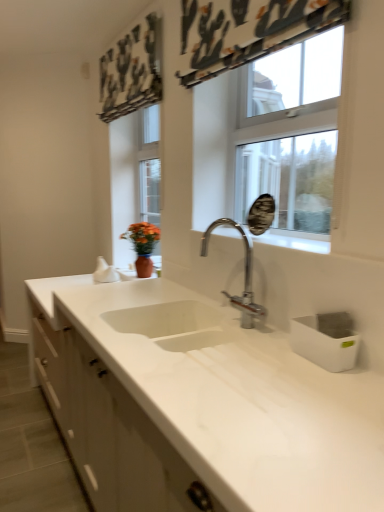
Question: Considering the positions of chrome metallic faucet at center and clear glass window at upper center in the image, is chrome metallic faucet at center wider or thinner than clear glass window at upper center?

Choices:
 (A) thin
 (B) wide

Answer: (B)

Question: From the image's perspective, is chrome metallic faucet at center above or below clear glass window at upper center?

Choices:
 (A) below
 (B) above

Answer: (A)

Question: Is chrome metallic faucet at center inside the boundaries of clear glass window at upper center, or outside?

Choices:
 (A) outside
 (B) inside

Answer: (A)

Question: Looking at their shapes, would you say clear glass window at upper center is wider or thinner than chrome metallic faucet at center?

Choices:
 (A) wide
 (B) thin

Answer: (B)

Question: Based on their sizes in the image, would you say clear glass window at upper center is bigger or smaller than chrome metallic faucet at center?

Choices:
 (A) big
 (B) small

Answer: (A)

Question: Is clear glass window at upper center in front of or behind chrome metallic faucet at center in the image?

Choices:
 (A) front
 (B) behind

Answer: (B)

Question: In terms of height, does clear glass window at upper center look taller or shorter compared to chrome metallic faucet at center?

Choices:
 (A) short
 (B) tall

Answer: (B)